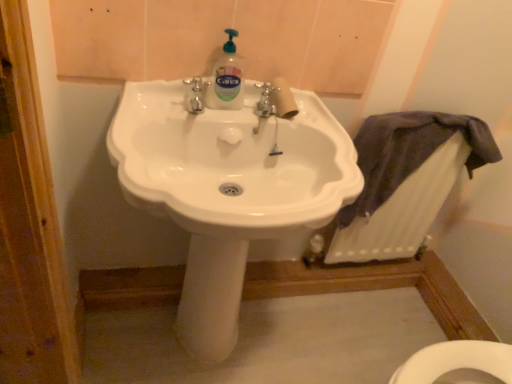
Where is `white glossy sink at center`? This screenshot has width=512, height=384. white glossy sink at center is located at coordinates (227, 189).

Is point (177, 195) positioned behind point (450, 187)?

No, it is in front of (450, 187).

Is white glossy sink at center in contact with white textured radiator at lower right?

No.

Can white glossy sink at center be found inside white textured radiator at lower right?

That's incorrect, white glossy sink at center is not inside white textured radiator at lower right.

Which is behind, white textured radiator at lower right or white glossy sink at center?

white textured radiator at lower right.

Are white textured radiator at lower right and white glossy sink at center far apart?

That's not correct — white textured radiator at lower right is a little close to white glossy sink at center.

Is white textured radiator at lower right facing away from white glossy sink at center?

No, white textured radiator at lower right is not facing away from white glossy sink at center.

Can you confirm if translucent plastic bottle at center is wider than white glossy sink at center?

In fact, translucent plastic bottle at center might be narrower than white glossy sink at center.

Based on the photo, from the image's perspective, does translucent plastic bottle at center appear higher than white glossy sink at center?

Correct, translucent plastic bottle at center appears higher than white glossy sink at center in the image.

How many degrees apart are the facing directions of translucent plastic bottle at center and white glossy sink at center?

The angle between the facing direction of translucent plastic bottle at center and the facing direction of white glossy sink at center is 0.00135 degrees.

Is translucent plastic bottle at center positioned with its back to white glossy sink at center?

No, translucent plastic bottle at center is not facing away from white glossy sink at center.

Is white textured radiator at lower right in front of translucent plastic bottle at center?

No, it is not.

Between white textured radiator at lower right and translucent plastic bottle at center, which one appears on the right side from the viewer's perspective?

white textured radiator at lower right.

Can you confirm if white textured radiator at lower right is shorter than translucent plastic bottle at center?

Incorrect, the height of white textured radiator at lower right does not fall short of that of translucent plastic bottle at center.

Would you say white textured radiator at lower right contains translucent plastic bottle at center?

No, translucent plastic bottle at center is not inside white textured radiator at lower right.

From the image's perspective, would you say white glossy sink at center is shown under translucent plastic bottle at center?

Yes.

Is white glossy sink at center not close to translucent plastic bottle at center?

That's not correct — white glossy sink at center is a little close to translucent plastic bottle at center.

Which of these two, white glossy sink at center or translucent plastic bottle at center, is bigger?

white glossy sink at center.

From a real-world perspective, is white glossy sink at center positioned under translucent plastic bottle at center based on gravity?

Indeed, from a real-world perspective, white glossy sink at center is positioned beneath translucent plastic bottle at center.

What's the angular difference between translucent plastic bottle at center and white textured radiator at lower right's facing directions?

They differ by 0.00389 degrees in their facing directions.

Is translucent plastic bottle at center not inside white textured radiator at lower right?

Absolutely, translucent plastic bottle at center is external to white textured radiator at lower right.

Is translucent plastic bottle at center shorter than white textured radiator at lower right?

Yes, translucent plastic bottle at center is shorter than white textured radiator at lower right.

Can you see translucent plastic bottle at center touching white textured radiator at lower right?

No, translucent plastic bottle at center is not touching white textured radiator at lower right.

In the image, there is a white textured radiator at lower right. Where is `sink below it (from the image's perspective)`? This screenshot has height=384, width=512. sink below it (from the image's perspective) is located at coordinates (227, 189).

Where is `radiator above the white glossy sink at center (from a real-world perspective)`? This screenshot has height=384, width=512. radiator above the white glossy sink at center (from a real-world perspective) is located at coordinates (403, 211).

From the image, which object appears to be nearer to white glossy sink at center, translucent plastic bottle at center or white textured radiator at lower right?

translucent plastic bottle at center is positioned closer to the anchor white glossy sink at center.

Considering their positions, is white glossy sink at center positioned further to translucent plastic bottle at center than white textured radiator at lower right?

Based on the image, white textured radiator at lower right appears to be further to translucent plastic bottle at center.

Considering their positions, is white glossy sink at center positioned further to white textured radiator at lower right than translucent plastic bottle at center?

The object further to white textured radiator at lower right is translucent plastic bottle at center.

Consider the image. Which object lies nearer to the anchor point white textured radiator at lower right, translucent plastic bottle at center or white glossy sink at center?

white glossy sink at center is closer to white textured radiator at lower right.

In the scene shown: Based on their spatial positions, is white textured radiator at lower right or translucent plastic bottle at center further from white glossy sink at center?

white textured radiator at lower right.

Considering their positions, is white textured radiator at lower right positioned further to translucent plastic bottle at center than white glossy sink at center?

Based on the image, white textured radiator at lower right appears to be further to translucent plastic bottle at center.

Where is `cleaning product between white glossy sink at center and white textured radiator at lower right`? Image resolution: width=512 pixels, height=384 pixels. cleaning product between white glossy sink at center and white textured radiator at lower right is located at coordinates (227, 78).